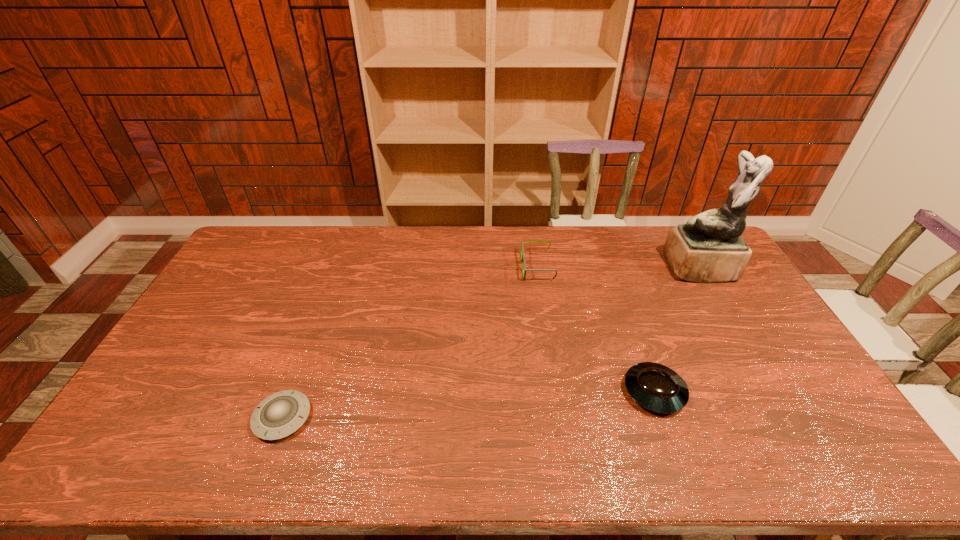
At what (x,y) coordinates should I click in order to perform the action: click on vacant space that satisfies the following two spatial constraints: 1. on the lens of the second object from left to right; 2. on the left side of the third object from left to right. Please return your answer as a coordinate pair (x, y). Looking at the image, I should click on (557, 392).

This screenshot has height=540, width=960. I want to click on free space that satisfies the following two spatial constraints: 1. on the lens of the taller saucer; 2. on the left side of the second object from left to right, so click(557, 392).